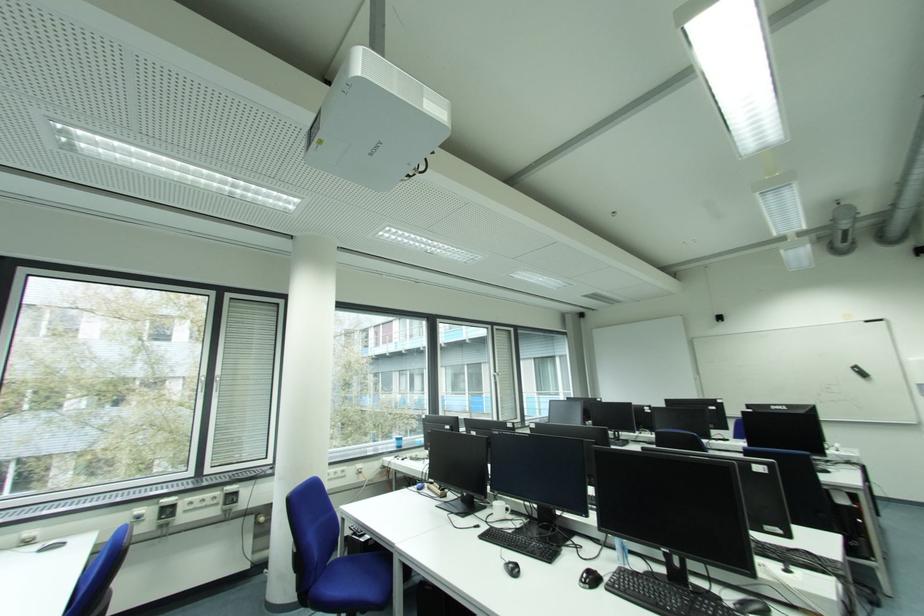
The height and width of the screenshot is (616, 924). In order to click on blue chair sitting surface in this screenshot , I will do `click(355, 582)`.